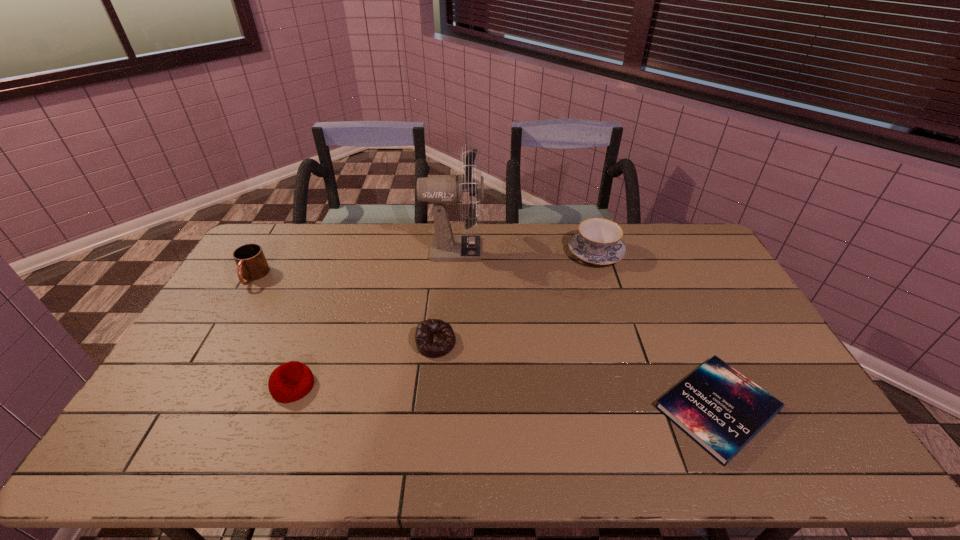
You are a GUI agent. You are given a task and a screenshot of the screen. Output one action in this format:
    pyautogui.click(x=<x>, y=<y>)
    Task: Click on the free space that satisfies the following two spatial constraints: 1. on the seat area of the left beanbag; 2. on the back side of the hardback book
    
    Given the screenshot: What is the action you would take?
    pyautogui.click(x=285, y=408)

Identify the location of free point that satisfies the following two spatial constraints: 1. on the air flow direction of the fan; 2. on the side of the mug with the handle. (451, 277).